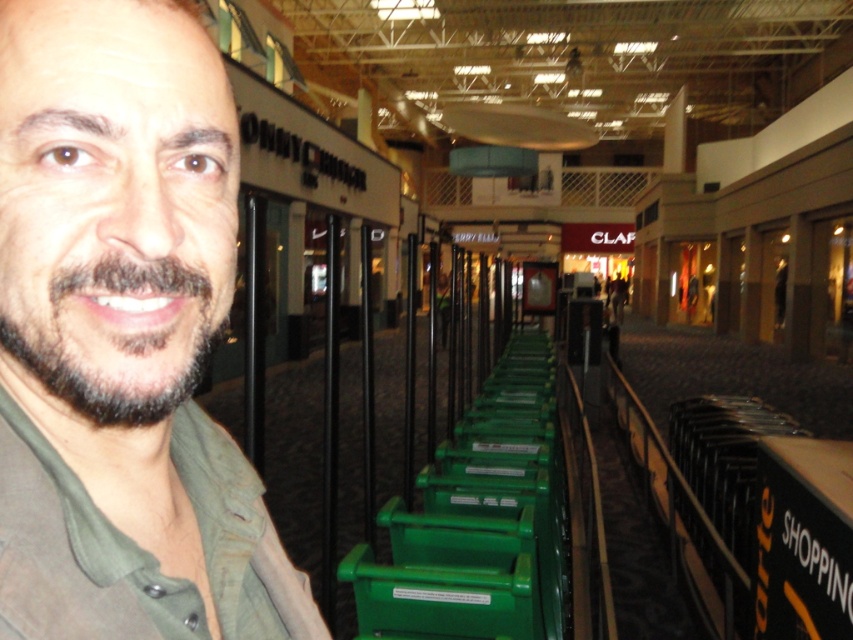
Question: Does matte green shirt at center come behind dark brown fuzzy beard at left?

Choices:
 (A) yes
 (B) no

Answer: (B)

Question: Which point is closer to the camera taking this photo?

Choices:
 (A) (196, 342)
 (B) (18, 545)

Answer: (B)

Question: Which point is farther to the camera?

Choices:
 (A) dark brown fuzzy beard at left
 (B) matte green shirt at center

Answer: (A)

Question: Does matte green shirt at center have a lesser width compared to dark brown fuzzy beard at left?

Choices:
 (A) no
 (B) yes

Answer: (A)

Question: Which of the following is the farthest from the observer?

Choices:
 (A) (167, 579)
 (B) (143, 403)

Answer: (A)

Question: Is matte green shirt at center below dark brown fuzzy beard at left?

Choices:
 (A) yes
 (B) no

Answer: (A)